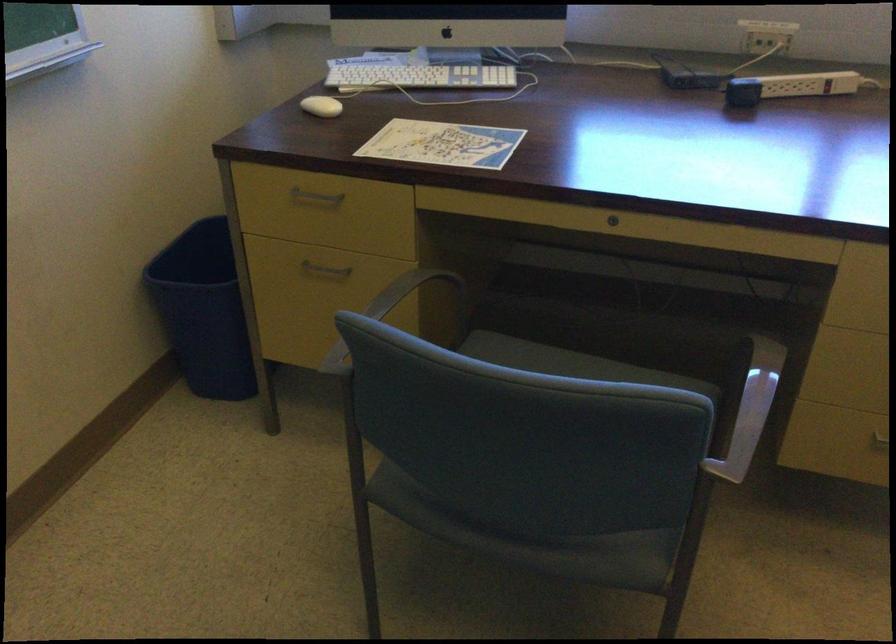
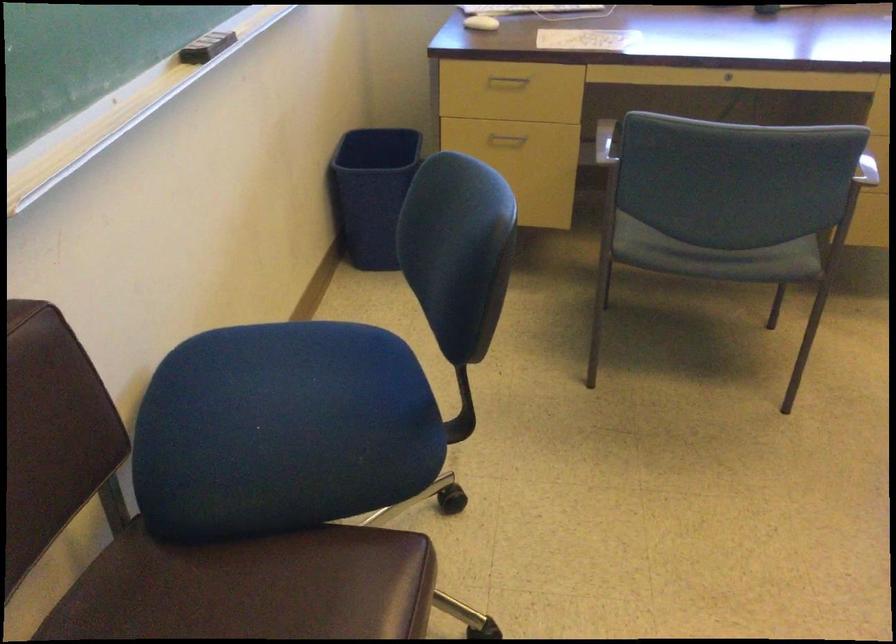
In a continuous first-person perspective shot, in which direction is the camera moving?

The cameraman moved toward left, backward.